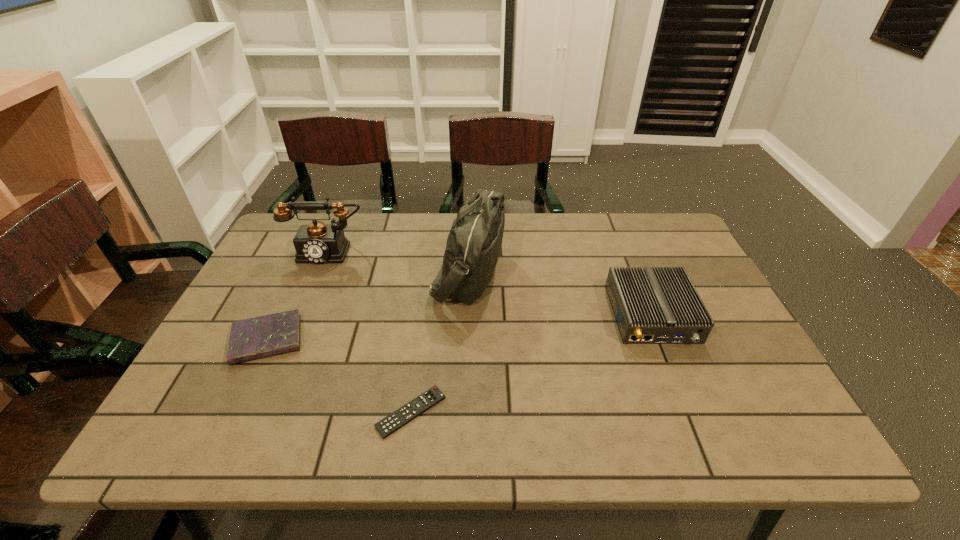
Identify the location of free space at the near edge of the desktop. The image size is (960, 540). (602, 449).

Find the location of a particular element. free spot at the left edge of the desktop is located at coordinates (247, 296).

Identify the location of free region at the right edge. (728, 397).

The width and height of the screenshot is (960, 540). In the image, there is a desktop. What are the coordinates of `vacant space at the near left corner` in the screenshot? It's located at (173, 415).

At what (x,y) coordinates should I click in order to perform the action: click on free spot at the far right corner of the desktop. Please return your answer as a coordinate pair (x, y). The image size is (960, 540). Looking at the image, I should click on [x=672, y=234].

Identify the location of vacant region between the shoulder bag and the shortest object. The height and width of the screenshot is (540, 960). (440, 342).

At what (x,y) coordinates should I click in order to perform the action: click on vacant point located between the second shortest object and the rightmost object. Please return your answer as a coordinate pair (x, y). The height and width of the screenshot is (540, 960). Looking at the image, I should click on coord(460,327).

Where is `blank region between the shortest object and the router`? Image resolution: width=960 pixels, height=540 pixels. blank region between the shortest object and the router is located at coordinates (532, 363).

Where is `free space between the diary and the rightmost object`? The width and height of the screenshot is (960, 540). free space between the diary and the rightmost object is located at coordinates (x=460, y=327).

Find the location of a particular element. The height and width of the screenshot is (540, 960). unoccupied position between the shortest object and the telephone is located at coordinates (370, 331).